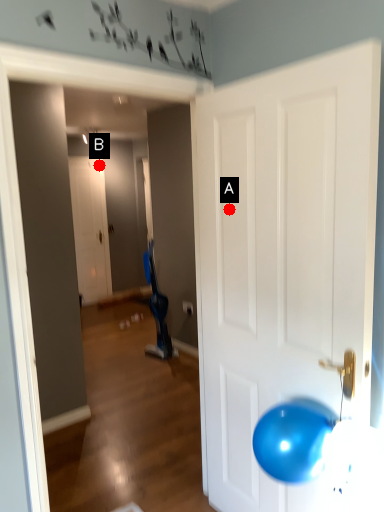
Question: Two points are circled on the image, labeled by A and B beside each circle. Which point is further to the camera?

Choices:
 (A) A is further
 (B) B is further

Answer: (B)